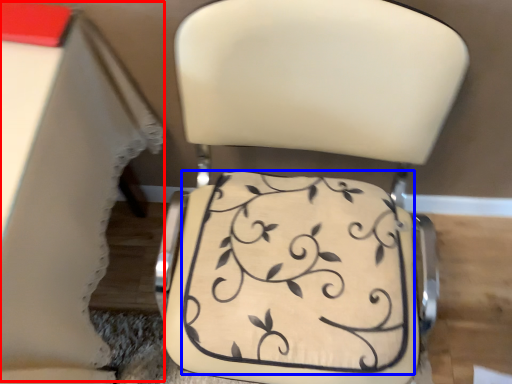
Question: Which of the following is the farthest to the observer, table (highlighted by a red box) or wedding cake (highlighted by a blue box)?

Choices:
 (A) table
 (B) wedding cake

Answer: (B)